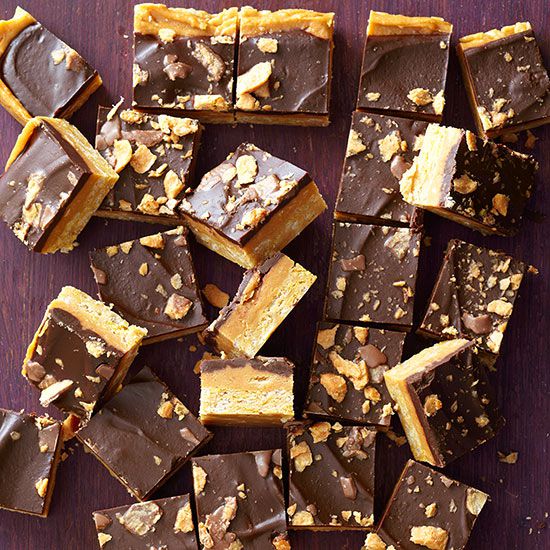
This screenshot has height=550, width=550. What are the coordinates of `loose crumbs` in the screenshot? It's located at (510, 456), (397, 438), (205, 354), (216, 294), (533, 138), (511, 136).